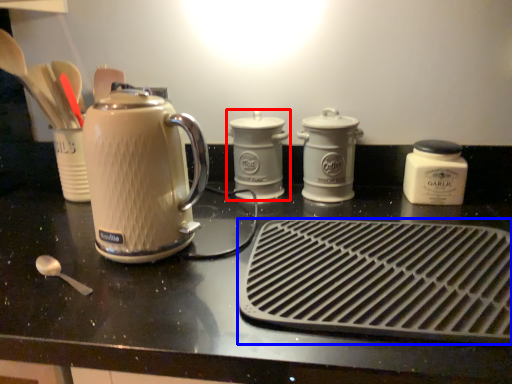
Question: Which object appears closest to the camera in this image, kitchen appliance (highlighted by a red box) or kitchen appliance (highlighted by a blue box)?

Choices:
 (A) kitchen appliance
 (B) kitchen appliance

Answer: (B)